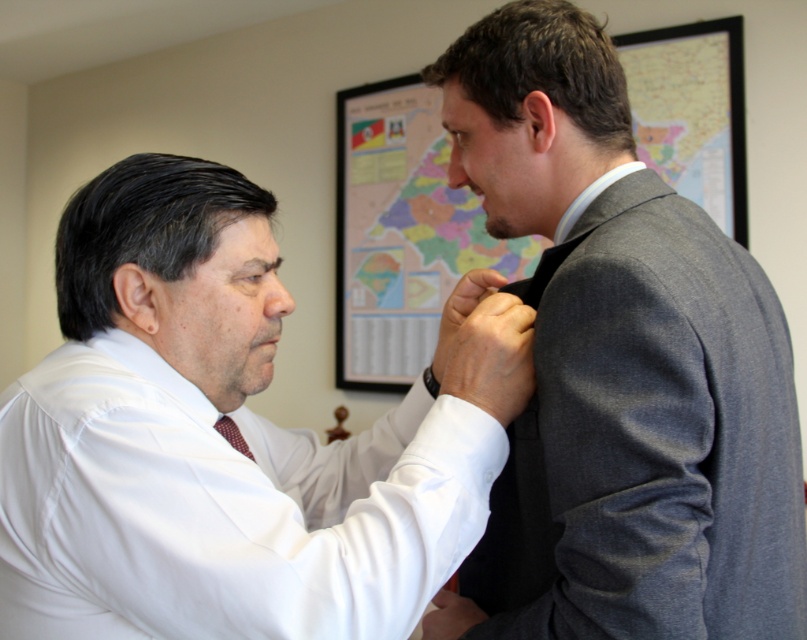
Question: Which object appears farthest from the camera in this image?

Choices:
 (A) white smooth shirt at center
 (B) maroon silk tie at center

Answer: (B)

Question: Considering the real-world distances, which object is farthest from the white smooth shirt at center?

Choices:
 (A) gray wool suit at center
 (B) maroon silk tie at center

Answer: (B)

Question: Can you confirm if gray wool suit at center is positioned to the right of maroon silk tie at center?

Choices:
 (A) yes
 (B) no

Answer: (A)

Question: Can you confirm if white smooth shirt at center is bigger than maroon silk tie at center?

Choices:
 (A) no
 (B) yes

Answer: (B)

Question: Is gray wool suit at center smaller than maroon silk tie at center?

Choices:
 (A) no
 (B) yes

Answer: (A)

Question: Which object is positioned closest to the maroon silk tie at center?

Choices:
 (A) gray wool suit at center
 (B) white smooth shirt at center

Answer: (B)